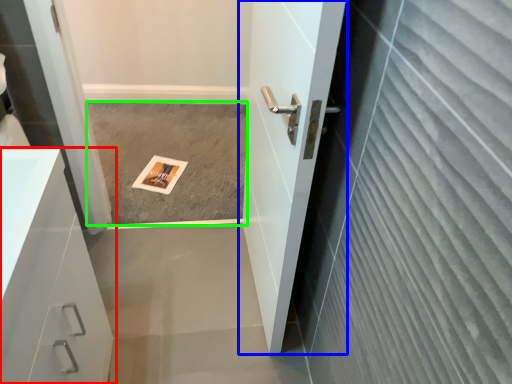
Question: Which is farther away from bathroom cabinet (highlighted by a red box)? door (highlighted by a blue box) or concrete (highlighted by a green box)?

Choices:
 (A) door
 (B) concrete

Answer: (B)